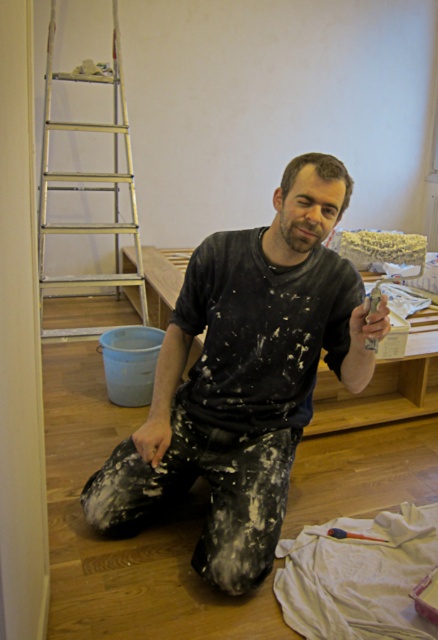
You are a painter who needs to move a tool from the silver metallic ladder at left to the black matte shirt at center. Which object will require more space to move around?

The silver metallic ladder at left requires more space to move around than the black matte shirt at center because the black matte shirt at center occupies less space than the silver metallic ladder at left.

You are a painter who just arrived at the work site. You see the black matte shirt at center and the silver metallic ladder at left. Which object is closer to you?

The black matte shirt at center is closer to the viewer than the silver metallic ladder at left.